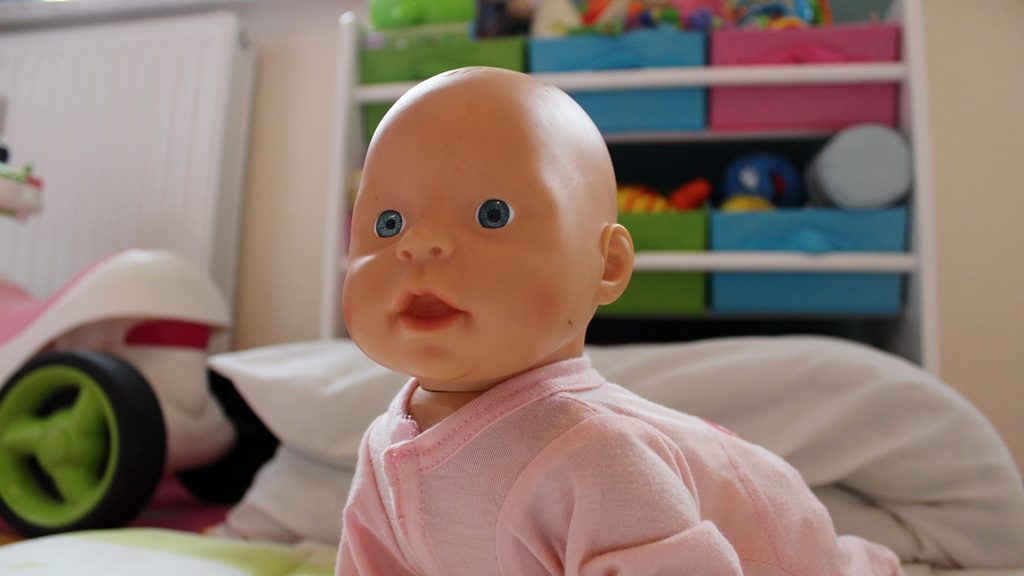
Locate an element on the screen. wall is located at coordinates tap(987, 92), tap(272, 147).